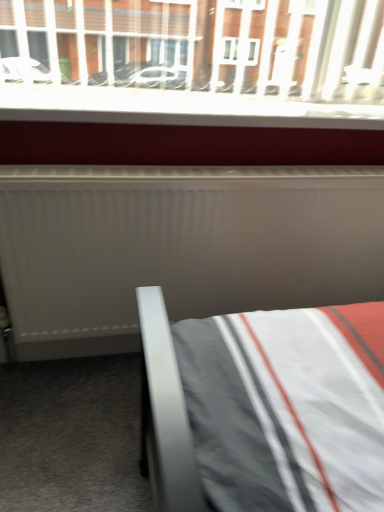
Question: Is white matte radiator at center at the right side of white plastic window sill at upper center?

Choices:
 (A) yes
 (B) no

Answer: (A)

Question: Is white plastic window sill at upper center inside white matte radiator at center?

Choices:
 (A) no
 (B) yes

Answer: (A)

Question: Does white matte radiator at center lie in front of white plastic window sill at upper center?

Choices:
 (A) yes
 (B) no

Answer: (A)

Question: Considering the relative sizes of white matte radiator at center and white plastic window sill at upper center in the image provided, is white matte radiator at center thinner than white plastic window sill at upper center?

Choices:
 (A) no
 (B) yes

Answer: (B)

Question: Is white matte radiator at center touching white plastic window sill at upper center?

Choices:
 (A) yes
 (B) no

Answer: (B)

Question: Does white matte radiator at center have a lesser height compared to white plastic window sill at upper center?

Choices:
 (A) yes
 (B) no

Answer: (B)

Question: Is white plastic window sill at upper center to the right of white matte radiator at center from the viewer's perspective?

Choices:
 (A) no
 (B) yes

Answer: (A)

Question: Does white plastic window sill at upper center have a lesser height compared to white matte radiator at center?

Choices:
 (A) no
 (B) yes

Answer: (B)

Question: Is white plastic window sill at upper center thinner than white matte radiator at center?

Choices:
 (A) no
 (B) yes

Answer: (A)

Question: From the image's perspective, is white plastic window sill at upper center below white matte radiator at center?

Choices:
 (A) yes
 (B) no

Answer: (B)

Question: Would you say white plastic window sill at upper center contains white matte radiator at center?

Choices:
 (A) yes
 (B) no

Answer: (B)

Question: Is white plastic window sill at upper center positioned behind white matte radiator at center?

Choices:
 (A) no
 (B) yes

Answer: (B)

Question: Considering the positions of point (256, 122) and point (104, 257), is point (256, 122) closer or farther from the camera than point (104, 257)?

Choices:
 (A) closer
 (B) farther

Answer: (A)